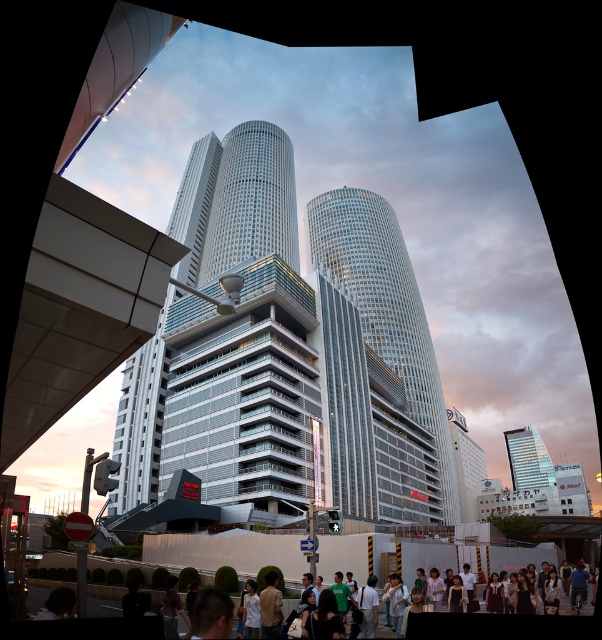
Is point (406, 369) less distant than point (517, 486)?

That is True.

Which is below, glassy silver skyscraper at center or matte glass skyscraper at center?

matte glass skyscraper at center

Between point (408, 300) and point (507, 432), which one is positioned behind?

Point (507, 432)

Locate an element on the screen. glassy silver skyscraper at center is located at coordinates coord(385,305).

Which is more to the right, glassy steel skyscraper at center or glassy silver skyscraper at center?

From the viewer's perspective, glassy steel skyscraper at center appears more on the right side.

Does glassy steel skyscraper at center appear over glassy silver skyscraper at center?

No, glassy steel skyscraper at center is not above glassy silver skyscraper at center.

Between point (205, 163) and point (374, 198), which one is positioned in front?

Point (205, 163) is more forward.

Locate an element on the screen. This screenshot has height=640, width=602. glassy steel skyscraper at center is located at coordinates (287, 356).

Does glassy steel skyscraper at center appear on the right side of matte glass skyscraper at center?

In fact, glassy steel skyscraper at center is to the left of matte glass skyscraper at center.

Does glassy steel skyscraper at center appear on the left side of matte glass skyscraper at center?

Indeed, glassy steel skyscraper at center is positioned on the left side of matte glass skyscraper at center.

Which is behind, point (188, 440) or point (542, 467)?

Positioned behind is point (542, 467).

The width and height of the screenshot is (602, 640). Identify the location of glassy steel skyscraper at center. (287, 356).